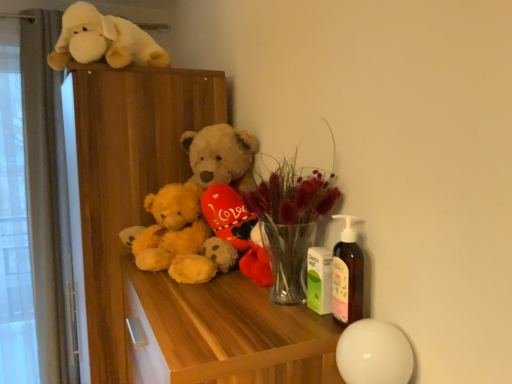
Find the location of a particular element. The height and width of the screenshot is (384, 512). free point below translucent glass vase at center (from a real-world perspective) is located at coordinates (279, 308).